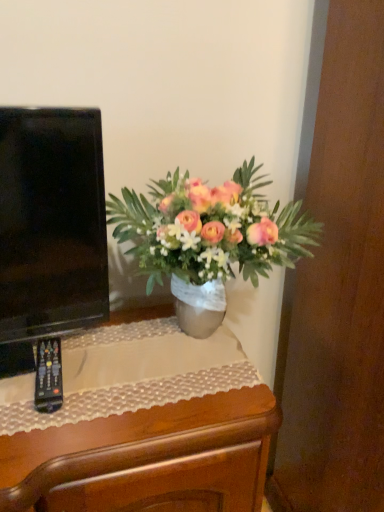
Where is `unoccupied region to the right of black plastic remote at lower left`? The height and width of the screenshot is (512, 384). unoccupied region to the right of black plastic remote at lower left is located at coordinates (130, 381).